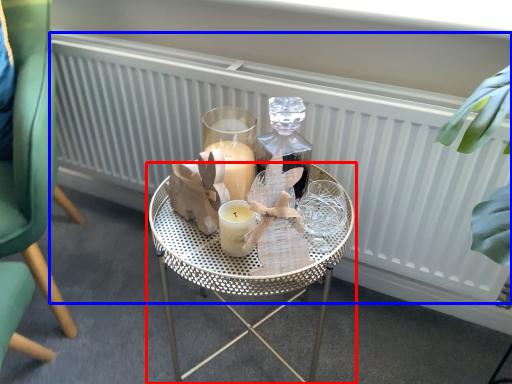
Question: Which object appears farthest to the camera in this image, table (highlighted by a red box) or radiator (highlighted by a blue box)?

Choices:
 (A) table
 (B) radiator

Answer: (B)